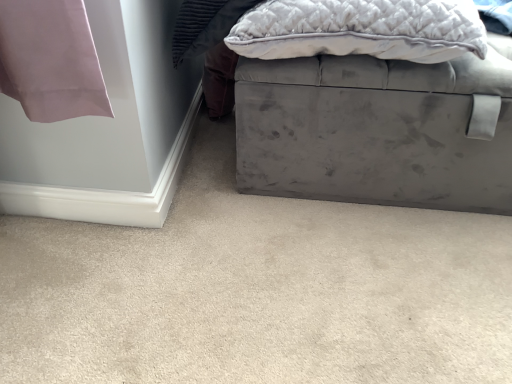
This screenshot has height=384, width=512. What do you see at coordinates (376, 130) in the screenshot?
I see `velvet gray ottoman at center` at bounding box center [376, 130].

At what (x,y) coordinates should I click in order to perform the action: click on velvet gray ottoman at lower right. Please return your answer as a coordinate pair (x, y). The height and width of the screenshot is (384, 512). Looking at the image, I should click on (259, 297).

Can you tell me how much velvet gray ottoman at center and velvet gray pillow at upper right differ in facing direction?

The angular difference between velvet gray ottoman at center and velvet gray pillow at upper right is 2.9e-05 degrees.

Is velvet gray ottoman at center turned away from velvet gray pillow at upper right?

velvet gray ottoman at center is not turned away from velvet gray pillow at upper right.

Consider the image. Would you say velvet gray pillow at upper right is part of velvet gray ottoman at center's contents?

No, velvet gray pillow at upper right is not inside velvet gray ottoman at center.

Measure the distance between velvet gray ottoman at center and velvet gray pillow at upper right.

The distance of velvet gray ottoman at center from velvet gray pillow at upper right is 5.56 inches.

Which is closer to the camera, (x=440, y=307) or (x=362, y=115)?

The point (x=440, y=307) is in front.

Would you say velvet gray ottoman at lower right is to the left or to the right of velvet gray ottoman at center in the picture?

In the image, velvet gray ottoman at lower right appears on the left side of velvet gray ottoman at center.

Looking at the image, does velvet gray ottoman at lower right seem bigger or smaller compared to velvet gray ottoman at center?

velvet gray ottoman at lower right is smaller than velvet gray ottoman at center.

In terms of width, does velvet gray ottoman at lower right look wider or thinner when compared to velvet gray ottoman at center?

Clearly, velvet gray ottoman at lower right has more width compared to velvet gray ottoman at center.

From a real-world perspective, relative to velvet gray pillow at upper right, is velvet gray ottoman at lower right vertically above or below?

velvet gray ottoman at lower right is situated lower than velvet gray pillow at upper right in the real world.

Is velvet gray ottoman at lower right beside velvet gray pillow at upper right?

They are not placed beside each other.

Is velvet gray ottoman at lower right facing away from velvet gray pillow at upper right?

No, velvet gray ottoman at lower right's orientation is not away from velvet gray pillow at upper right.

Is velvet gray pillow at upper right located within velvet gray ottoman at lower right?

No, velvet gray pillow at upper right is not inside velvet gray ottoman at lower right.

Is velvet gray ottoman at center inside or outside of velvet gray ottoman at lower right?

velvet gray ottoman at center is outside velvet gray ottoman at lower right.

From a real-world perspective, is velvet gray ottoman at center above or below velvet gray ottoman at lower right?

velvet gray ottoman at center is above velvet gray ottoman at lower right.

This screenshot has height=384, width=512. In order to click on concrete below the velvet gray ottoman at center (from the image's perspective) in this screenshot , I will do `click(259, 297)`.

Does velvet gray pillow at upper right have a greater width compared to velvet gray ottoman at lower right?

No, velvet gray pillow at upper right is not wider than velvet gray ottoman at lower right.

How different are the orientations of velvet gray pillow at upper right and velvet gray ottoman at lower right in degrees?

velvet gray pillow at upper right and velvet gray ottoman at lower right are facing 1.51 degrees away from each other.

Is velvet gray pillow at upper right positioned far away from velvet gray ottoman at lower right?

velvet gray pillow at upper right is actually quite close to velvet gray ottoman at lower right.

Is velvet gray pillow at upper right spatially inside velvet gray ottoman at lower right, or outside of it?

velvet gray pillow at upper right lies outside velvet gray ottoman at lower right.

In the scene shown: Is velvet gray pillow at upper right surrounding velvet gray ottoman at center?

No, velvet gray pillow at upper right does not contain velvet gray ottoman at center.

From the picture: From a real-world perspective, is velvet gray pillow at upper right physically located above or below velvet gray ottoman at center?

From a real-world perspective, velvet gray pillow at upper right is physically above velvet gray ottoman at center.

Who is bigger, velvet gray pillow at upper right or velvet gray ottoman at center?

Bigger between the two is velvet gray ottoman at center.

How much distance is there between velvet gray pillow at upper right and velvet gray ottoman at center?

velvet gray pillow at upper right and velvet gray ottoman at center are 5.56 inches apart from each other.

Where is `furniture located underneath the velvet gray pillow at upper right (from a real-world perspective)`? This screenshot has height=384, width=512. furniture located underneath the velvet gray pillow at upper right (from a real-world perspective) is located at coordinates (376, 130).

Identify the location of concrete in front of the velvet gray ottoman at center. This screenshot has height=384, width=512. 259,297.

From the image, which object appears to be nearer to velvet gray ottoman at lower right, velvet gray pillow at upper right or velvet gray ottoman at center?

velvet gray ottoman at center is closer to velvet gray ottoman at lower right.

From the image, which object appears to be farther from velvet gray pillow at upper right, velvet gray ottoman at center or velvet gray ottoman at lower right?

velvet gray ottoman at lower right is positioned further to the anchor velvet gray pillow at upper right.

Based on their spatial positions, is velvet gray pillow at upper right or velvet gray ottoman at lower right further from velvet gray ottoman at center?

Among the two, velvet gray ottoman at lower right is located further to velvet gray ottoman at center.

From the image, which object appears to be farther from velvet gray ottoman at lower right, velvet gray ottoman at center or velvet gray pillow at upper right?

Among the two, velvet gray pillow at upper right is located further to velvet gray ottoman at lower right.

Which object lies further to the anchor point velvet gray ottoman at center, velvet gray ottoman at lower right or velvet gray pillow at upper right?

velvet gray ottoman at lower right lies further to velvet gray ottoman at center than the other object.

Based on their spatial positions, is velvet gray ottoman at lower right or velvet gray ottoman at center closer to velvet gray pillow at upper right?

The object closer to velvet gray pillow at upper right is velvet gray ottoman at center.

Where is `furniture between velvet gray pillow at upper right and velvet gray ottoman at lower right vertically`? This screenshot has height=384, width=512. furniture between velvet gray pillow at upper right and velvet gray ottoman at lower right vertically is located at coordinates (376, 130).